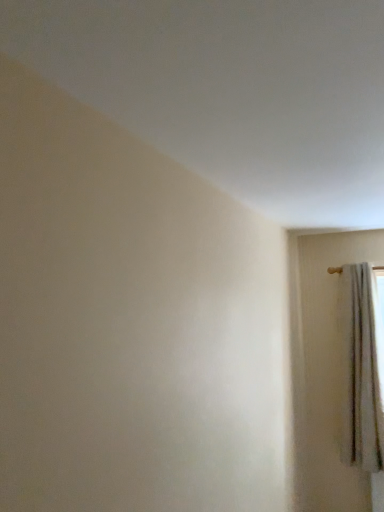
Locate an element on the screen. light gray textured curtain at right is located at coordinates (361, 371).

What do you see at coordinates (361, 371) in the screenshot? I see `light gray textured curtain at right` at bounding box center [361, 371].

Find the location of a particular element. The width and height of the screenshot is (384, 512). light gray textured curtain at right is located at coordinates (361, 371).